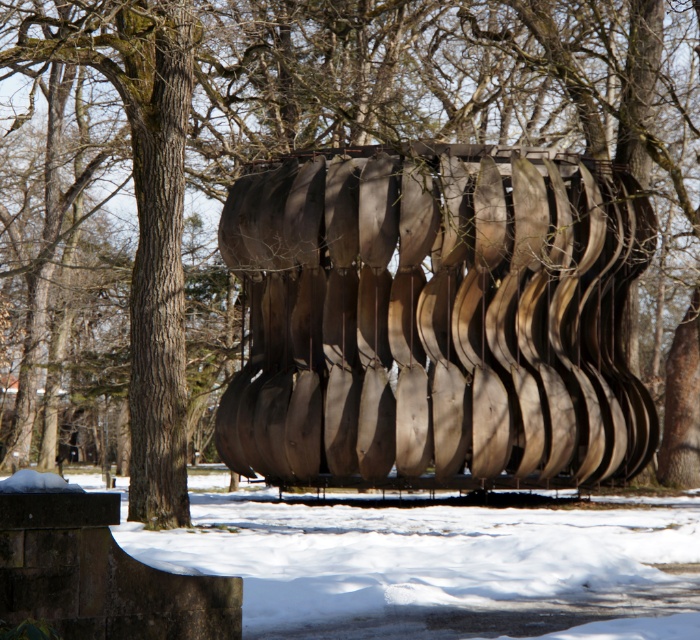
Question: Which point is closer to the camera?

Choices:
 (A) (630, 497)
 (B) (567, 220)

Answer: (B)

Question: Which object appears farthest from the camera in this image?

Choices:
 (A) white powdery snow at lower center
 (B) wooden sculpture at center

Answer: (B)

Question: Can you confirm if wooden sculpture at center is positioned above white powdery snow at lower center?

Choices:
 (A) yes
 (B) no

Answer: (A)

Question: Does wooden sculpture at center have a lesser width compared to white powdery snow at lower center?

Choices:
 (A) no
 (B) yes

Answer: (B)

Question: Is wooden sculpture at center to the left of white powdery snow at lower center from the viewer's perspective?

Choices:
 (A) no
 (B) yes

Answer: (A)